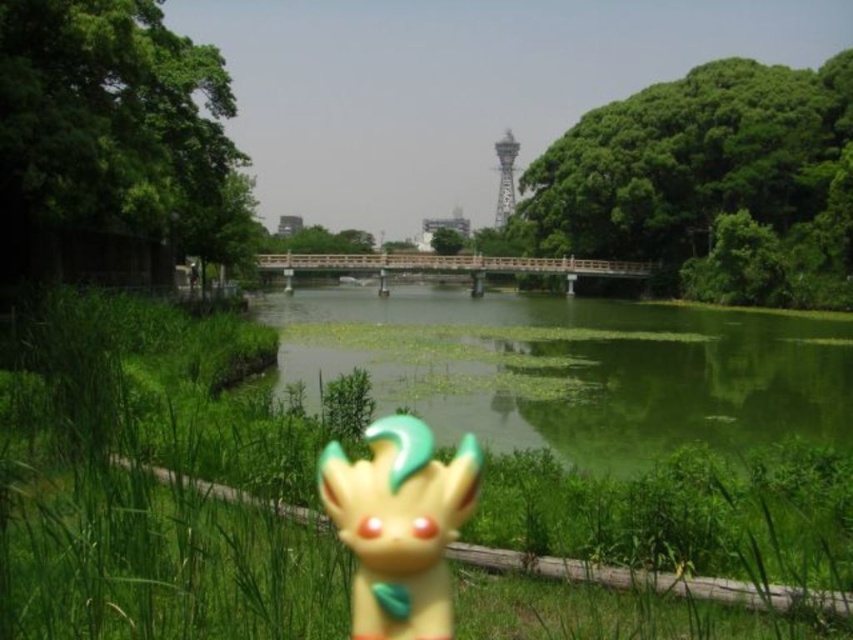
Question: Does green matte grass at center appear on the right side of metallic silver tower at center?

Choices:
 (A) no
 (B) yes

Answer: (A)

Question: Estimate the real-world distances between objects in this image. Which object is closer to the green grassy river at center?

Choices:
 (A) green matte grass at center
 (B) metallic silver tower at center

Answer: (A)

Question: Is the position of green grassy river at center more distant than that of metallic silver tower at center?

Choices:
 (A) yes
 (B) no

Answer: (B)

Question: Can you confirm if green grassy river at center is positioned above yellow matte figurine at center?

Choices:
 (A) yes
 (B) no

Answer: (A)

Question: Considering the real-world distances, which object is farthest from the yellow matte figurine at center?

Choices:
 (A) green matte grass at center
 (B) metallic silver tower at center
 (C) green grassy river at center

Answer: (B)

Question: Which object is positioned farthest from the yellow matte figurine at center?

Choices:
 (A) green matte grass at center
 (B) metallic silver tower at center
 (C) green grassy river at center

Answer: (B)